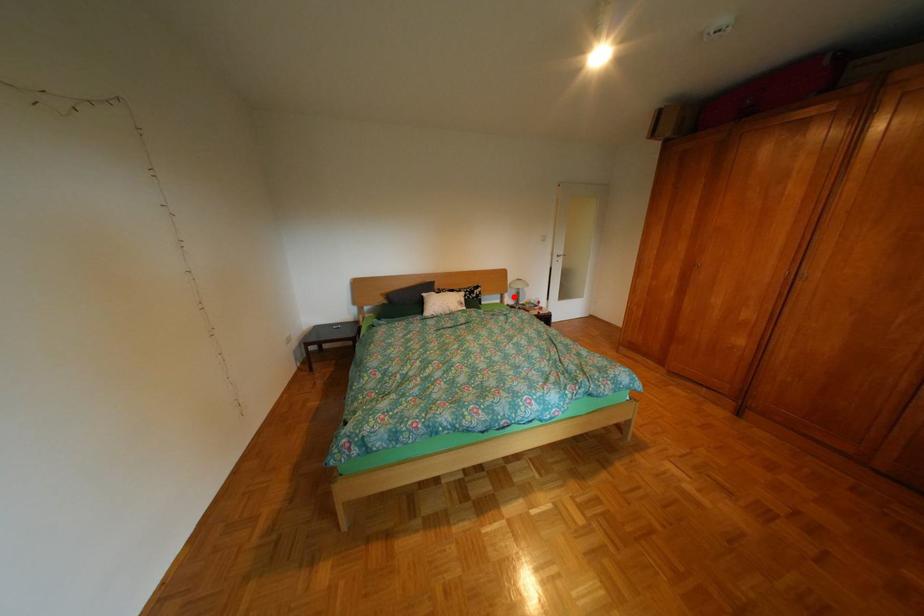
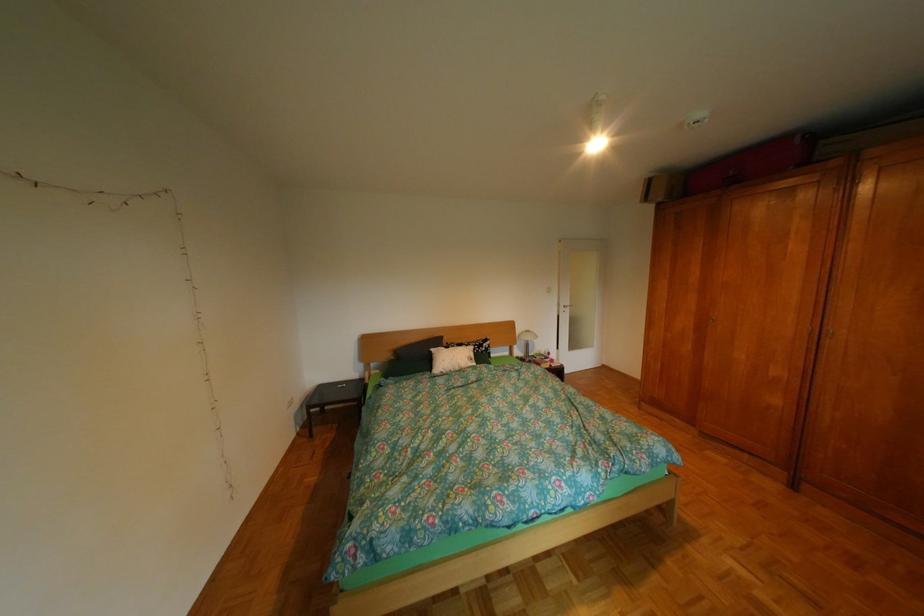
Question: I am providing you with two images of the same scene from different viewpoints. Given a red point in image1, look at the same physical point in image2. Is it:

Choices:
 (A) Closer to the viewpoint
 (B) Farther from the viewpoint

Answer: (B)